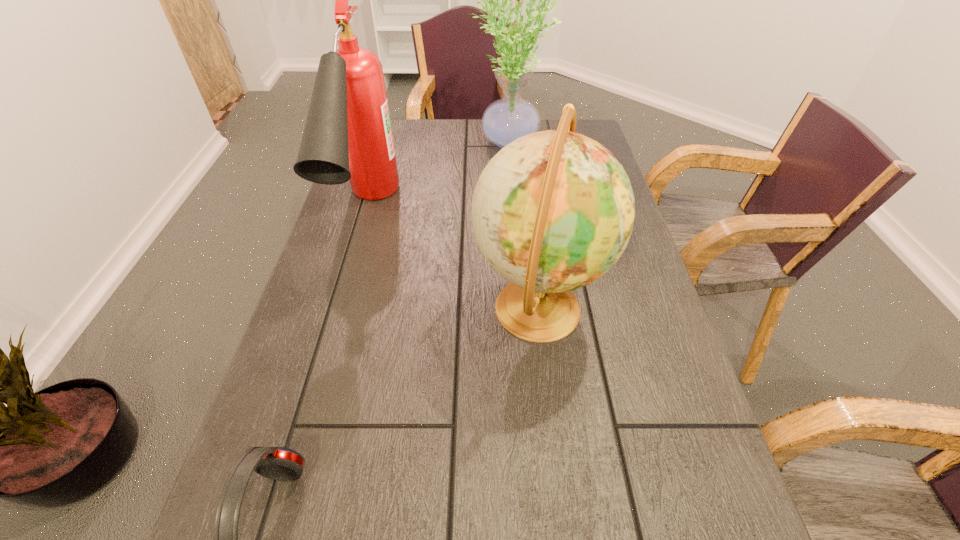
This screenshot has width=960, height=540. Identify the location of flower arrangement. (504, 120).

The height and width of the screenshot is (540, 960). Find the location of `fire extinguisher`. fire extinguisher is located at coordinates (347, 136).

Locate an element on the screen. Image resolution: width=960 pixels, height=540 pixels. the third tallest object is located at coordinates (553, 211).

What are the coordinates of `free space located 0.400m on the front of the flower arrangement` in the screenshot? It's located at (514, 258).

Where is `vacant area situated 0.130m at the nozzle of the fire extinguisher`? The image size is (960, 540). vacant area situated 0.130m at the nozzle of the fire extinguisher is located at coordinates (336, 329).

You are a GUI agent. You are given a task and a screenshot of the screen. Output one action in this format:
    pyautogui.click(x=<x>, y=<y>)
    Task: Click on the vacant space situated 0.370m on the left of the globe
    The height and width of the screenshot is (540, 960).
    Given the screenshot: What is the action you would take?
    pyautogui.click(x=299, y=308)

You are a GUI agent. You are given a task and a screenshot of the screen. Output one action in this format:
    pyautogui.click(x=<x>, y=<y>)
    Task: Click on the object that is positioned at the far edge
    The width and height of the screenshot is (960, 540).
    Given the screenshot: What is the action you would take?
    pyautogui.click(x=504, y=120)

Identify the location of object that is at the left edge. (347, 136).

I want to click on object present at the right edge, so click(x=553, y=211).

What are the coordinates of `free location at the far edge of the desktop` in the screenshot? It's located at (454, 153).